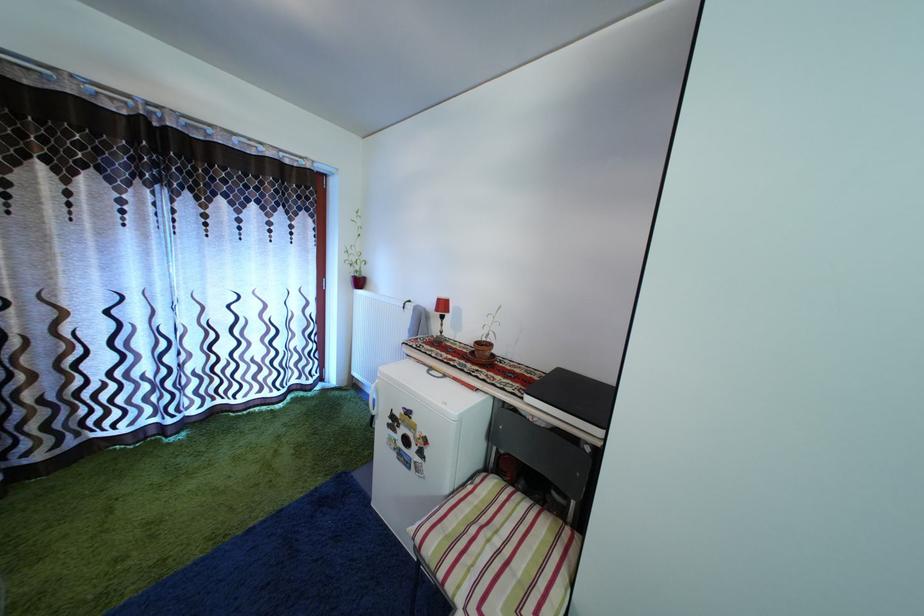
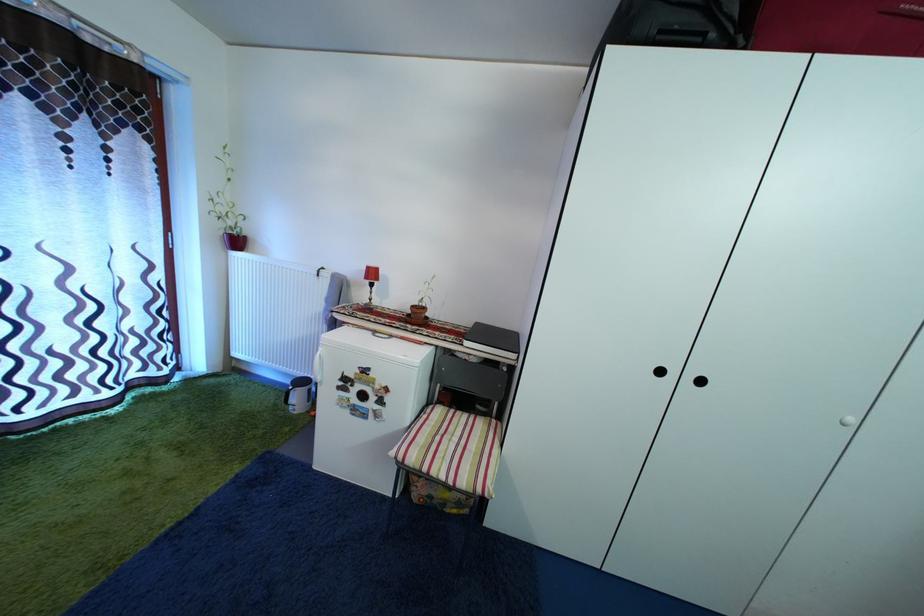
The images are taken continuously from a first-person perspective. In which direction are you moving?

The cameraman moved toward left, backward.